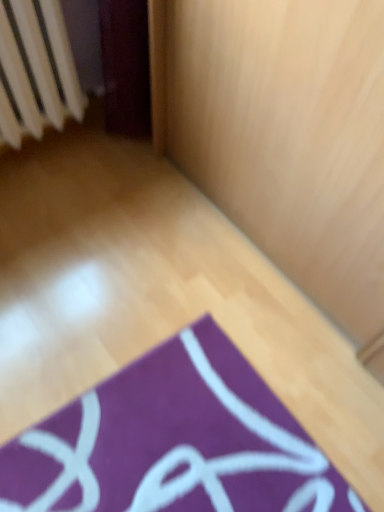
This screenshot has height=512, width=384. Find the location of `vacant space underneath purple fabric yoga mat at lower center (from a real-world perspective)`. vacant space underneath purple fabric yoga mat at lower center (from a real-world perspective) is located at coordinates (169, 451).